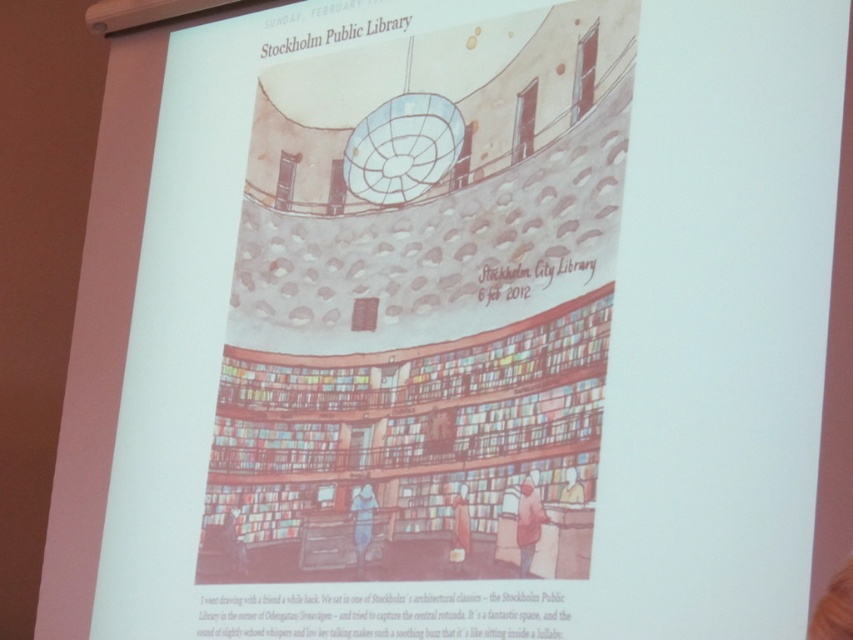
Can you confirm if smooth beige coat at lower center is positioned above light blue fabric at lower center?

Yes.

How distant is smooth beige coat at lower center from light blue fabric at lower center?

They are 92.28 centimeters apart.

Where is `smooth beige coat at lower center`? smooth beige coat at lower center is located at coordinates pos(459,528).

Where is `smooth beige coat at lower center`? smooth beige coat at lower center is located at coordinates (459, 528).

Is denim jacket at lower center to the left of light blue fabric at lower center from the viewer's perspective?

No, denim jacket at lower center is not to the left of light blue fabric at lower center.

Based on the photo, which of these two, denim jacket at lower center or light blue fabric at lower center, stands taller?

denim jacket at lower center

Is point (357, 492) behind point (241, 563)?

No, it is not.

Locate an element on the screen. This screenshot has width=853, height=640. denim jacket at lower center is located at coordinates (363, 524).

Does denim jacket at lower center have a smaller size compared to smooth beige coat at lower center?

No, denim jacket at lower center is not smaller than smooth beige coat at lower center.

Who is lower down, denim jacket at lower center or smooth beige coat at lower center?

Positioned lower is denim jacket at lower center.

Who is more forward, (358, 525) or (465, 536)?

Point (465, 536) is in front.

The height and width of the screenshot is (640, 853). I want to click on denim jacket at lower center, so click(x=363, y=524).